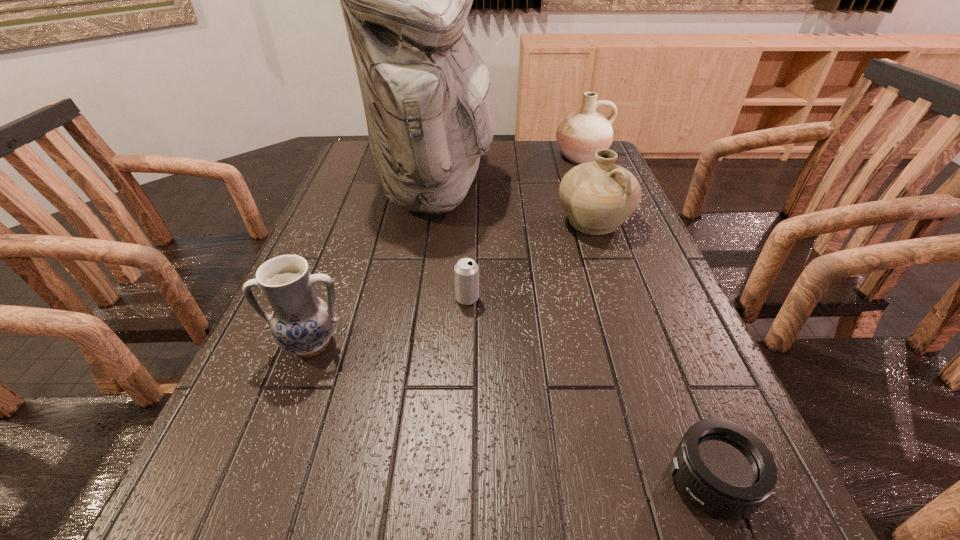
Where is `free space located 0.400m to pour from the handle of the farthest pottery`? The image size is (960, 540). free space located 0.400m to pour from the handle of the farthest pottery is located at coordinates (615, 244).

Where is `free space located 0.080m on the front of the second farthest pottery`? The image size is (960, 540). free space located 0.080m on the front of the second farthest pottery is located at coordinates (609, 265).

The height and width of the screenshot is (540, 960). What are the coordinates of `free space located 0.330m on the back of the nearest pottery` in the screenshot? It's located at (353, 231).

Find the location of a particular element. Image resolution: width=960 pixels, height=540 pixels. vacant region located 0.310m on the left of the second shortest object is located at coordinates (313, 299).

Where is `vacant space located 0.340m on the side of the shortest object with brand markings and control switches`? Image resolution: width=960 pixels, height=540 pixels. vacant space located 0.340m on the side of the shortest object with brand markings and control switches is located at coordinates (441, 483).

You are a GUI agent. You are given a task and a screenshot of the screen. Output one action in this format:
    pyautogui.click(x=<x>, y=<y>)
    Task: Click on the vacant space located 0.200m on the side of the shortest object with brand markings and control switches
    
    Given the screenshot: What is the action you would take?
    pyautogui.click(x=535, y=483)

This screenshot has height=540, width=960. I want to click on vacant space situated on the side of the shortest object with brand markings and control switches, so click(x=635, y=483).

The image size is (960, 540). Find the location of `backpack that is at the far edge`. backpack that is at the far edge is located at coordinates (430, 105).

Find the location of `pottery at the far edge`. pottery at the far edge is located at coordinates (581, 134).

At what (x,y) coordinates should I click in order to perform the action: click on object located in the near edge section of the desktop. Please return your answer as a coordinate pair (x, y). The height and width of the screenshot is (540, 960). Looking at the image, I should click on (723, 469).